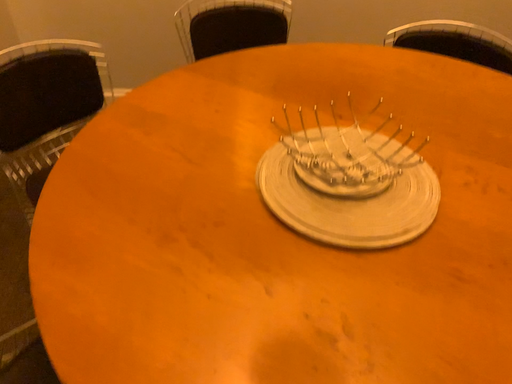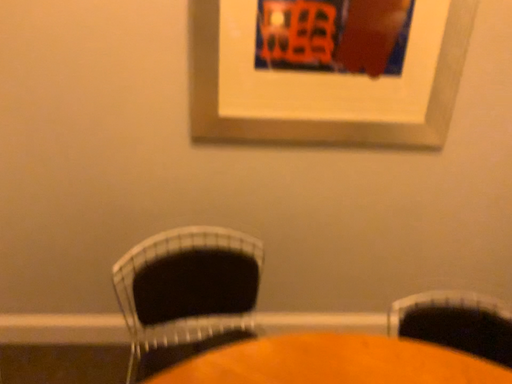
Question: How did the camera likely rotate when shooting the video?

Choices:
 (A) rotated upward
 (B) rotated downward

Answer: (A)